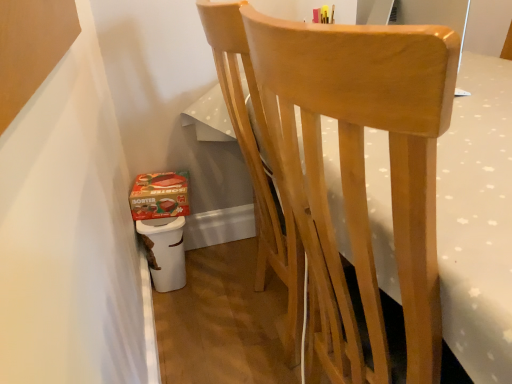
Based on the photo, measure the distance between natural wood chair at center and camera.

The depth of natural wood chair at center is 13.99 inches.

In order to click on natural wood chair at center in this screenshot , I will do `click(361, 173)`.

The image size is (512, 384). What are the coordinates of `chair above the white plastic potty at lower left (from a real-world perspective)` in the screenshot? It's located at (361, 173).

Are white plastic potty at lower left and natural wood chair at center beside each other?

white plastic potty at lower left and natural wood chair at center are clearly separated.

From a real-world perspective, between white plastic potty at lower left and natural wood chair at center, who is vertically higher?

natural wood chair at center is physically above.

Considering the points (151, 232) and (401, 158), which point is in front, point (151, 232) or point (401, 158)?

Positioned in front is point (401, 158).

Is natural wood chair at center facing away from matte cardboard box at lower left?

No, matte cardboard box at lower left is not at the back of natural wood chair at center.

Considering the sizes of objects natural wood chair at center and matte cardboard box at lower left in the image provided, who is wider, natural wood chair at center or matte cardboard box at lower left?

Wider between the two is natural wood chair at center.

Does natural wood chair at center have a greater height compared to matte cardboard box at lower left?

Correct, natural wood chair at center is much taller as matte cardboard box at lower left.

From a real-world perspective, is natural wood chair at center positioned under matte cardboard box at lower left based on gravity?

No, from a real-world perspective, natural wood chair at center is not beneath matte cardboard box at lower left.

In the scene shown: From the image's perspective, which is above, white plastic potty at lower left or matte cardboard box at lower left?

matte cardboard box at lower left is shown above in the image.

Do you think white plastic potty at lower left is within matte cardboard box at lower left, or outside of it?

white plastic potty at lower left is spatially situated outside matte cardboard box at lower left.

This screenshot has width=512, height=384. I want to click on potty lying below the matte cardboard box at lower left (from the image's perspective), so point(164,251).

Is matte cardboard box at lower left smaller than white plastic potty at lower left?

Yes.

Considering the sizes of matte cardboard box at lower left and white plastic potty at lower left in the image, is matte cardboard box at lower left taller or shorter than white plastic potty at lower left?

Clearly, matte cardboard box at lower left is shorter compared to white plastic potty at lower left.

Considering the positions of points (146, 208) and (138, 224), is point (146, 208) closer to camera compared to point (138, 224)?

No, (146, 208) is behind (138, 224).

Looking at this image, what's the angular difference between matte cardboard box at lower left and white plastic potty at lower left's facing directions?

There is a 5.26-degree angle between the facing directions of matte cardboard box at lower left and white plastic potty at lower left.

Locate an element on the screen. This screenshot has height=384, width=512. potty located underneath the natural wood chair at center (from a real-world perspective) is located at coordinates (164, 251).

Is natural wood chair at center completely or partially outside of white plastic potty at lower left?

Indeed, natural wood chair at center is completely outside white plastic potty at lower left.

Does point (441, 38) come closer to viewer compared to point (175, 222)?

That is True.

From a real-world perspective, is natural wood chair at center physically below white plastic potty at lower left?

No, from a real-world perspective, natural wood chair at center is not beneath white plastic potty at lower left.

From a real-world perspective, is matte cardboard box at lower left physically below natural wood chair at center?

Correct, in the physical world, matte cardboard box at lower left is lower than natural wood chair at center.

Is matte cardboard box at lower left oriented towards natural wood chair at center?

No, matte cardboard box at lower left is not oriented towards natural wood chair at center.

Is matte cardboard box at lower left taller or shorter than natural wood chair at center?

matte cardboard box at lower left is shorter than natural wood chair at center.

Can you tell me how much matte cardboard box at lower left and natural wood chair at center differ in facing direction?

95.7 degrees.

Locate an element on the screen. This screenshot has width=512, height=384. potty lying on the left of natural wood chair at center is located at coordinates (164, 251).

In order to click on chair that is in front of the matte cardboard box at lower left in this screenshot , I will do `click(361, 173)`.

From the image, which object appears to be nearer to white plastic potty at lower left, matte cardboard box at lower left or natural wood chair at center?

Based on the image, matte cardboard box at lower left appears to be nearer to white plastic potty at lower left.

When comparing their distances from white plastic potty at lower left, does natural wood chair at center or matte cardboard box at lower left seem further?

natural wood chair at center is positioned further to the anchor white plastic potty at lower left.

From the image, which object appears to be farther from natural wood chair at center, white plastic potty at lower left or matte cardboard box at lower left?

matte cardboard box at lower left is further to natural wood chair at center.

Estimate the real-world distances between objects in this image. Which object is closer to matte cardboard box at lower left, natural wood chair at center or white plastic potty at lower left?

white plastic potty at lower left.

Consider the image. Looking at the image, which one is located closer to natural wood chair at center, matte cardboard box at lower left or white plastic potty at lower left?

white plastic potty at lower left.

Estimate the real-world distances between objects in this image. Which object is further from matte cardboard box at lower left, white plastic potty at lower left or natural wood chair at center?

natural wood chair at center is further to matte cardboard box at lower left.

Image resolution: width=512 pixels, height=384 pixels. Identify the location of potty located between natural wood chair at center and matte cardboard box at lower left in the depth direction. (164, 251).